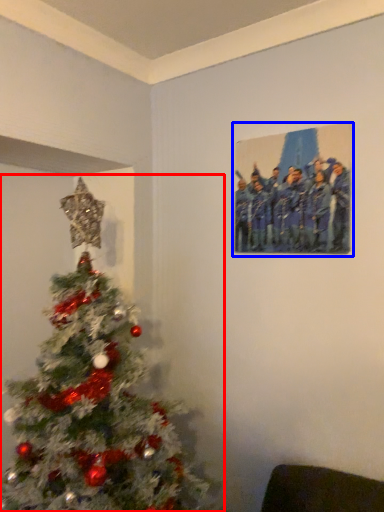
Question: Which of the following is the closest to the observer, christmas tree (highlighted by a red box) or picture frame (highlighted by a blue box)?

Choices:
 (A) christmas tree
 (B) picture frame

Answer: (A)